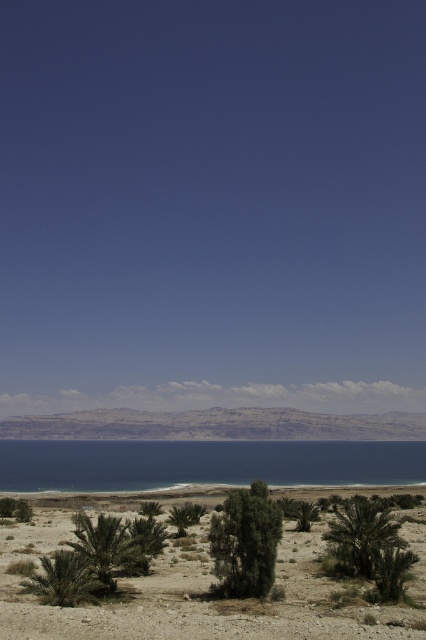
Question: Which of the following is the farthest from the observer?

Choices:
 (A) coord(101,525)
 (B) coord(393,451)
 (C) coord(353,547)
 (D) coord(19,579)

Answer: (B)

Question: Does green leafy palm tree at lower right have a larger size compared to green leafy palm tree at lower center?

Choices:
 (A) yes
 (B) no

Answer: (A)

Question: Where is green leafy bush at center located in relation to green leafy palm tree at lower left in the image?

Choices:
 (A) right
 (B) left

Answer: (A)

Question: Which object is closer to the camera taking this photo?

Choices:
 (A) green leafy palm tree at lower left
 (B) green leafy palm tree at lower right
 (C) green leafy bush at center

Answer: (A)

Question: Does green leafy bush at center appear under green leafy palm tree at lower right?

Choices:
 (A) no
 (B) yes

Answer: (A)

Question: Based on their relative distances, which object is nearer to the green shrubbery at lower left?

Choices:
 (A) green leafy bush at center
 (B) green leafy palm tree at lower left

Answer: (B)